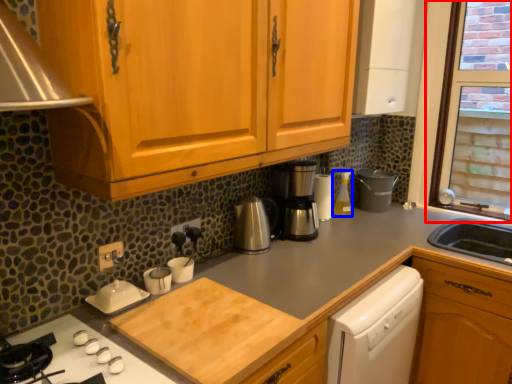
Question: Among these objects, which one is nearest to the camera, window (highlighted by a red box) or bottle (highlighted by a blue box)?

Choices:
 (A) window
 (B) bottle

Answer: (A)